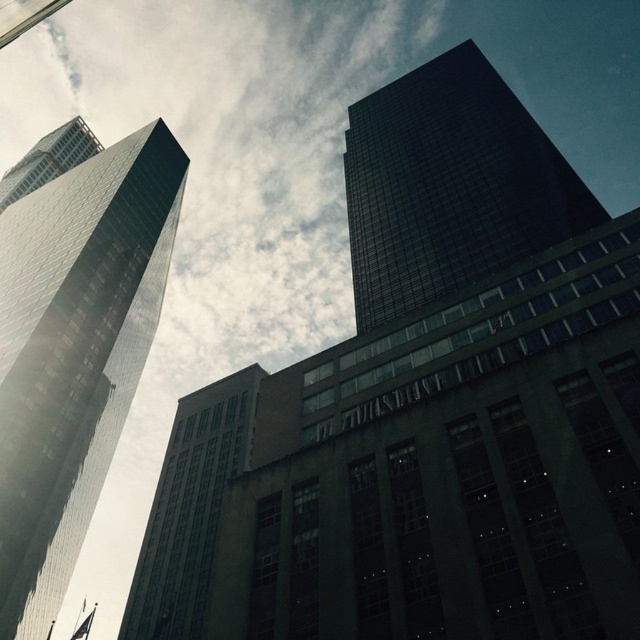
You are standing in the city square and want to take a photo of both the reflective glass skyscraper at left and the glassy reflective skyscraper at upper left. Which one should you adjust your camera angle to focus on first to ensure both are in the frame?

You should focus on the reflective glass skyscraper at left first because it is closer to you than the glassy reflective skyscraper at upper left, so adjusting your angle to include it will naturally bring the farther one into view as well.

You are standing at the base of the dark glass skyscraper at upper right and want to throw a ball to a friend who is 45 meters away from you. Can you reach them by throwing the ball horizontally?

The dark glass skyscraper at upper right and viewer are 42.25 meters apart, so if you are standing at the base of the dark glass skyscraper at upper right, your friend is 45 meters away, which is beyond the 42.25 meters distance between you and the skyscraper. Therefore, you cannot reach them by throwing the ball horizontally.

You are a drone operator tasked with flying a drone between the reflective glass skyscraper at left and the dark glass skyscraper at upper right. The drone has a maximum flight distance of 60 meters. Based on the cityscape described, can the drone safely complete this flight without exceeding its range?

The distance between the reflective glass skyscraper at left and the dark glass skyscraper at upper right is 58.15 meters, which is within the drone operator s 60 meter range. Therefore, the drone can safely complete the flight without exceeding its maximum flight distance.